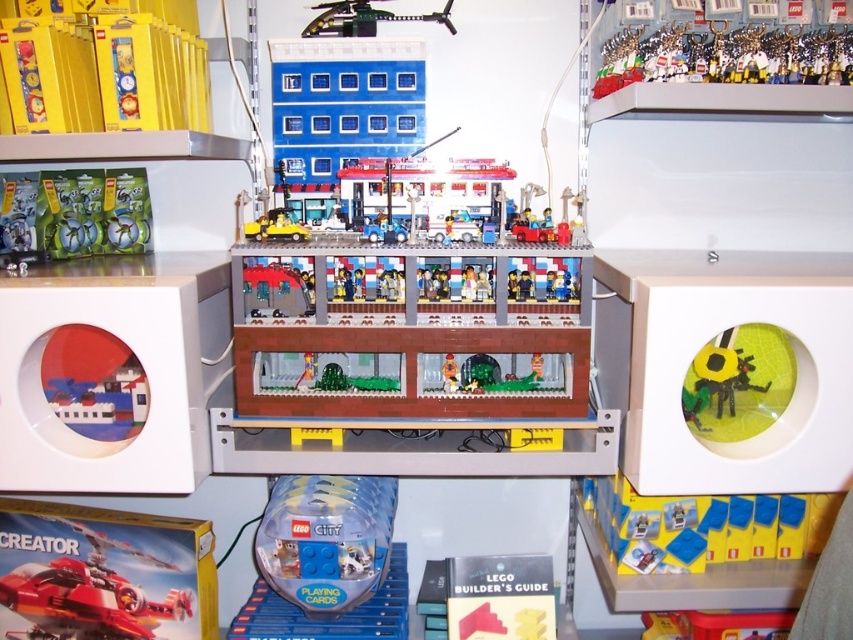
Question: Is shiny red airplane at lower left thinner than yellow matte sunflower at right?

Choices:
 (A) yes
 (B) no

Answer: (B)

Question: Which of the following is the farthest from the observer?

Choices:
 (A) yellow matte sunflower at right
 (B) metallic silver trophy at upper right
 (C) metallic green helicopter at upper center
 (D) shiny red airplane at lower left

Answer: (D)

Question: Does yellow matte sunflower at right lie in front of metallic green helicopter at upper center?

Choices:
 (A) no
 (B) yes

Answer: (B)

Question: Which object is farther from the camera taking this photo?

Choices:
 (A) yellow matte sunflower at right
 (B) shiny red airplane at lower left
 (C) metallic green helicopter at upper center

Answer: (B)

Question: Is yellow matte sunflower at right positioned before metallic green helicopter at upper center?

Choices:
 (A) no
 (B) yes

Answer: (B)

Question: Which of these objects is positioned farthest from the metallic green helicopter at upper center?

Choices:
 (A) shiny red airplane at lower left
 (B) yellow matte sunflower at right

Answer: (A)